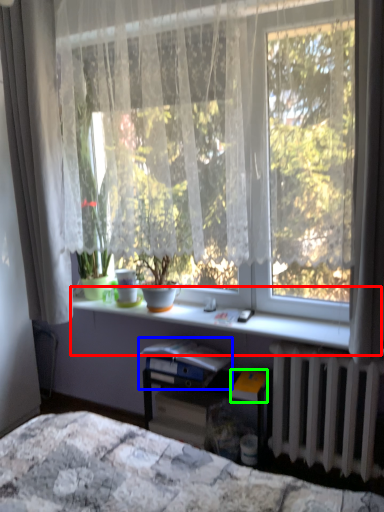
Question: Considering the real-world distances, which object is farthest from window sill (highlighted by a red box)? paperback book (highlighted by a blue box) or paperback book (highlighted by a green box)?

Choices:
 (A) paperback book
 (B) paperback book

Answer: (B)